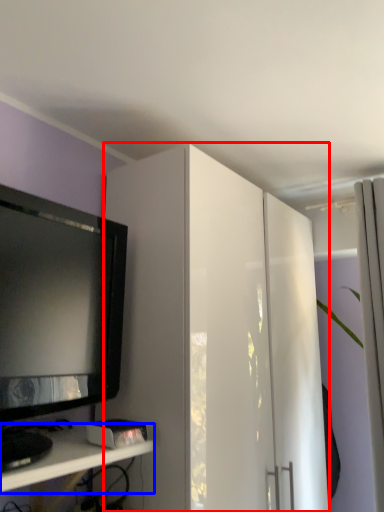
Question: Which point is further to the camera, cabinetry (highlighted by a red box) or shelf (highlighted by a blue box)?

Choices:
 (A) cabinetry
 (B) shelf

Answer: (A)